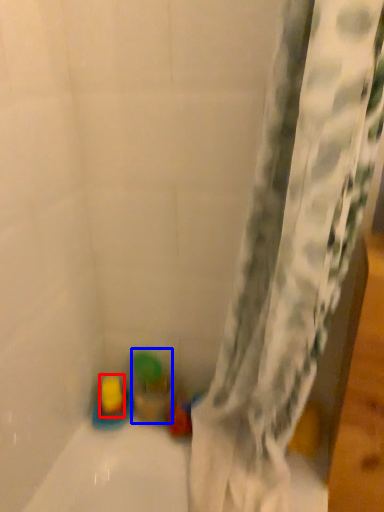
Question: Which point is closer to the camera, toy (highlighted by a red box) or toy (highlighted by a blue box)?

Choices:
 (A) toy
 (B) toy

Answer: (B)